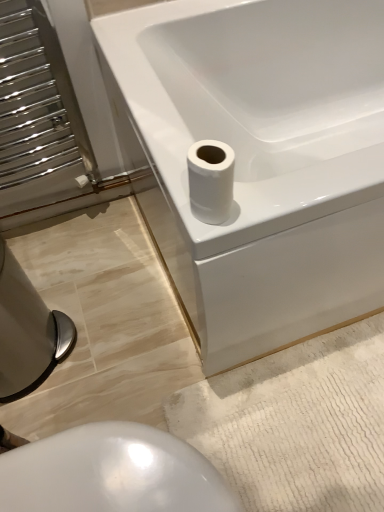
Question: Does point (13, 371) appear closer or farther from the camera than point (243, 99)?

Choices:
 (A) farther
 (B) closer

Answer: (B)

Question: Which is correct: brushed metal bidet at lower left, which ranks as the first bidet in left-to-right order, is inside white glossy bathtub at upper right, or outside of it?

Choices:
 (A) outside
 (B) inside

Answer: (A)

Question: Estimate the real-world distances between objects in this image. Which object is closer to the white glossy bidet at lower center, which is the first bidet from right to left?

Choices:
 (A) brushed metal bidet at lower left, the second bidet positioned from the right
 (B) white glossy bathtub at upper right
 (C) white glossy toilet paper at upper right

Answer: (C)

Question: Considering the real-world distances, which object is farthest from the white glossy toilet paper at upper right?

Choices:
 (A) white glossy bathtub at upper right
 (B) white glossy bidet at lower center, which is counted as the 2th bidet, starting from the left
 (C) brushed metal bidet at lower left, the second bidet positioned from the right

Answer: (C)